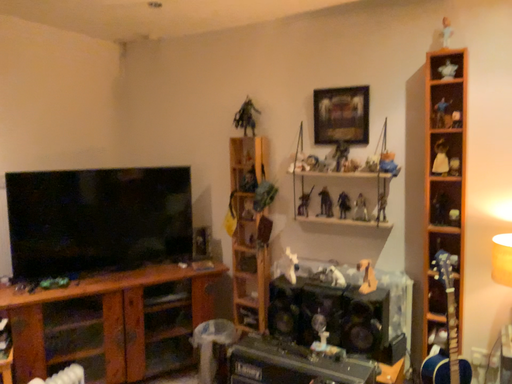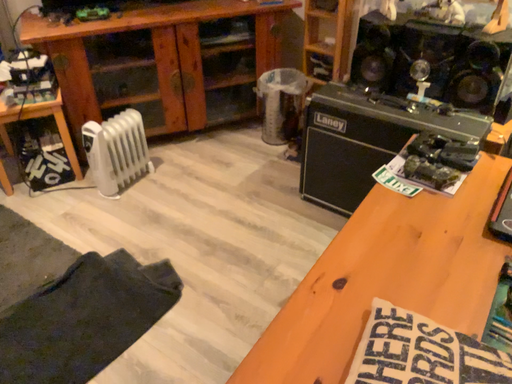
Question: How did the camera likely rotate when shooting the video?

Choices:
 (A) rotated downward
 (B) rotated upward

Answer: (A)